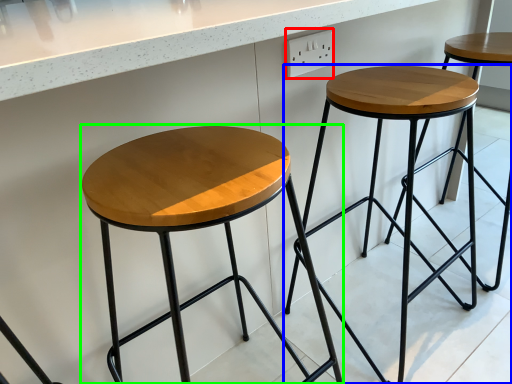
Question: Which object is positioned closest to electric outlet (highlighted by a red box)? Select from stool (highlighted by a blue box) and stool (highlighted by a green box).

Choices:
 (A) stool
 (B) stool

Answer: (A)